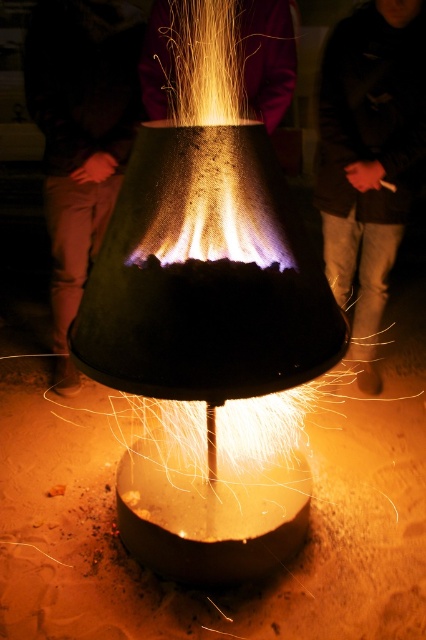
Question: Is sandy brown sand at bottom center smaller than dark brown leather jacket at center?

Choices:
 (A) no
 (B) yes

Answer: (A)

Question: Can you confirm if sandy brown sand at bottom center is positioned to the right of dark brown leather jacket at center?

Choices:
 (A) yes
 (B) no

Answer: (B)

Question: Can you confirm if sandy brown sand at bottom center is positioned to the left of dark brown leather jacket at center?

Choices:
 (A) yes
 (B) no

Answer: (A)

Question: Which of the following is the closest to the observer?

Choices:
 (A) sandy brown sand at bottom center
 (B) dark brown leather jacket at center

Answer: (A)

Question: Which object is farther from the camera taking this photo?

Choices:
 (A) dark brown leather jacket at center
 (B) sandy brown sand at bottom center

Answer: (A)